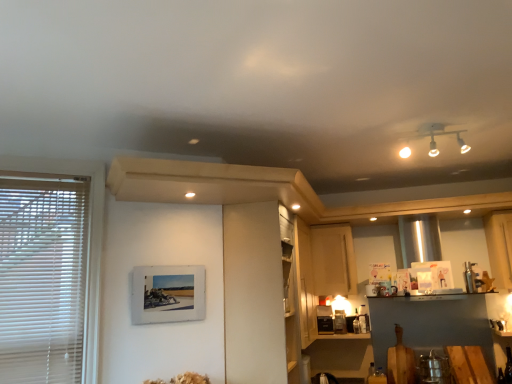
You are a GUI agent. You are given a task and a screenshot of the screen. Output one action in this format:
    pyautogui.click(x=<x>, y=<y>)
    Task: Click on the free spot above white blinds at left (from a real-world perspective)
    
    Given the screenshot: What is the action you would take?
    pyautogui.click(x=48, y=159)